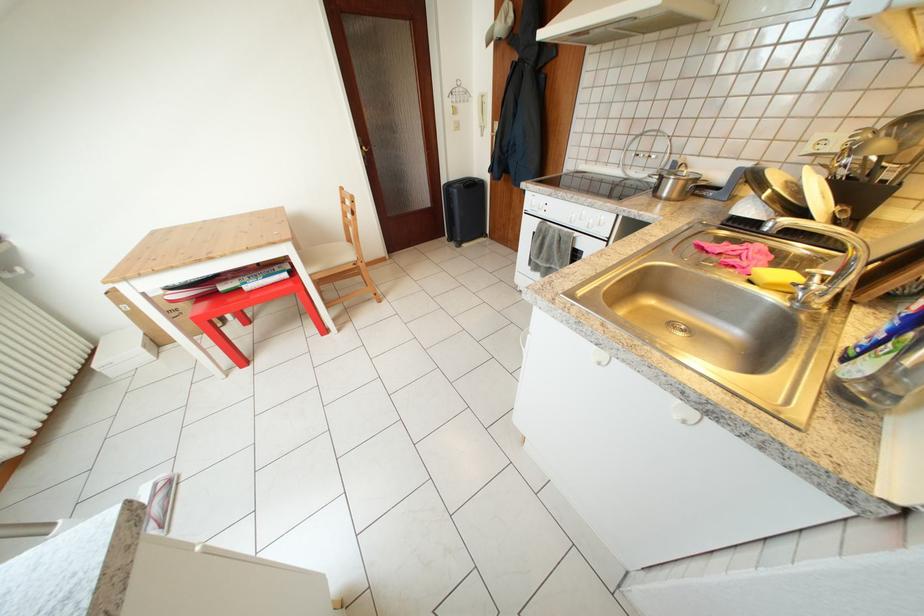
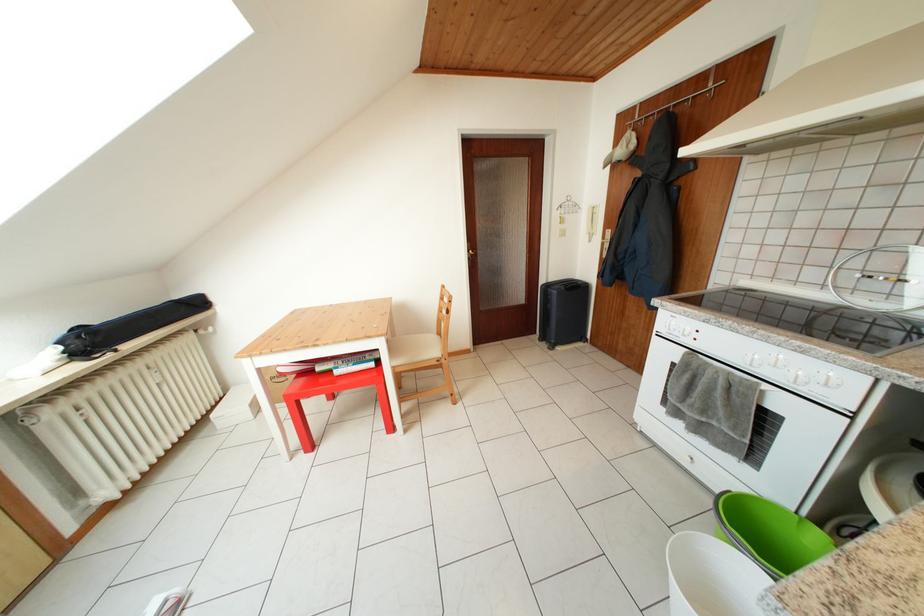
The point at (354, 261) is marked in the first image. Where is the corresponding point in the second image?

(440, 355)